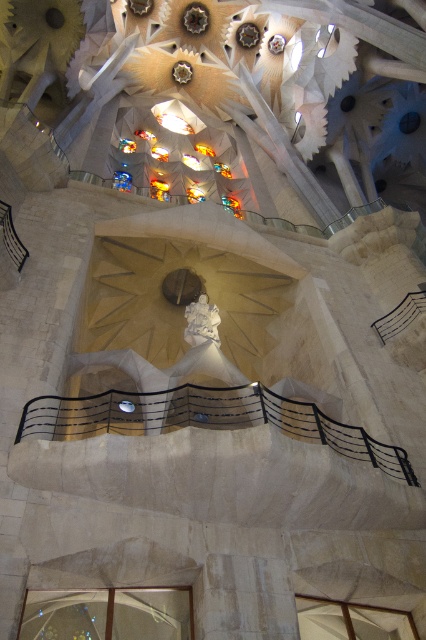
You are standing inside a cathedral and want to take a photo of the transparent glass window at lower left. If your camera has a maximum zoom range of 100 feet, can you capture the entire window without moving closer?

The transparent glass window at lower left is 130.68 feet away from the viewer. Since the camera can only zoom up to 100 feet, you cannot capture the entire window without moving closer.

You are an architect examining the cathedral interior. You notice the transparent glass window at lower left and the white marble statue at center. Which object occupies more space in the image?

The transparent glass window at lower left has a larger size compared to the white marble statue at center, so it occupies more space in the image.

You are standing in the cathedral and want to take a photo of the white marble statue at center. The transparent glass window at lower left has a beautiful view of the city. If your camera can focus on objects up to 30 meters away, will you be able to capture both the statue and the window in the same frame?

The transparent glass window at lower left is 35.71 meters away from the white marble statue at center. Since the camera can only focus up to 30 meters, the distance between them exceeds the camera range. Therefore, you cannot capture both in the same frame.